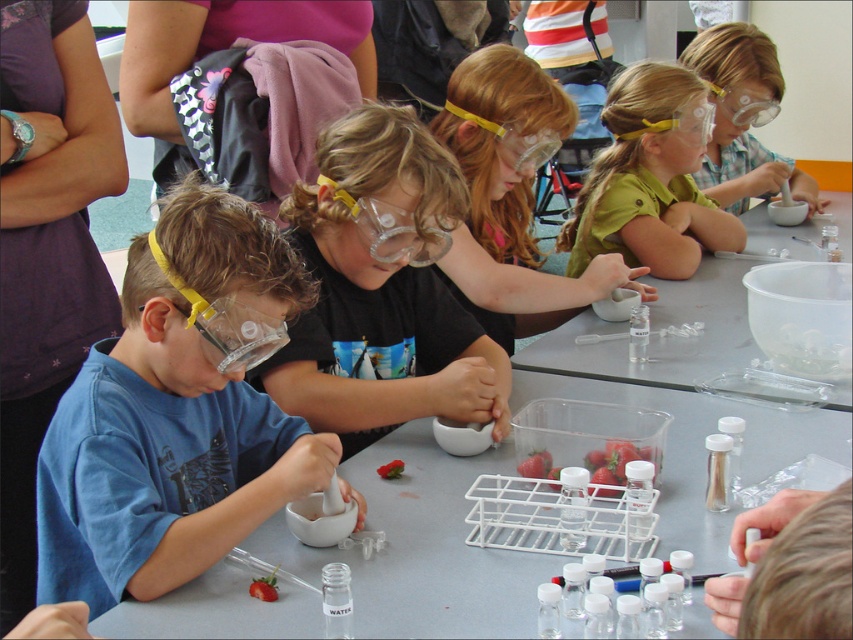
Question: Is white matte mortar at lower left to the right of green matte shirt at upper center from the viewer's perspective?

Choices:
 (A) yes
 (B) no

Answer: (B)

Question: Which object is positioned farthest from the clear plastic bowl at center?

Choices:
 (A) matte black mortar at center
 (B) blue matte shirt at left
 (C) clear plastic mortar at center

Answer: (B)

Question: Which object is the closest to the green matte shirt at upper center?

Choices:
 (A) blue matte shirt at left
 (B) clear plastic bowl at center
 (C) white matte mortar at lower left

Answer: (B)

Question: Does blue matte shirt at left come behind white matte mortar at lower left?

Choices:
 (A) no
 (B) yes

Answer: (B)

Question: Is matte black mortar at center bigger than green matte shirt at upper center?

Choices:
 (A) yes
 (B) no

Answer: (A)

Question: Which is nearer to the clear plastic bowl at center?

Choices:
 (A) matte black mortar at center
 (B) white matte mortar at lower left
 (C) green matte shirt at upper center

Answer: (C)